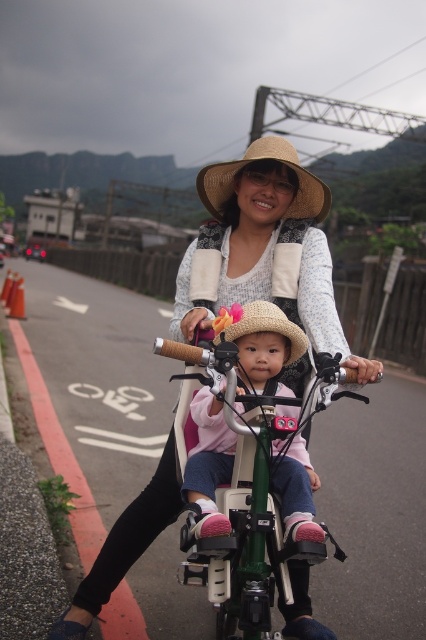
From the picture: Can you confirm if matte straw hat at center is thinner than strawmaterial/texturehat at upper center?

Yes, matte straw hat at center is thinner than strawmaterial/texturehat at upper center.

Does matte straw hat at center appear on the left side of strawmaterial/texturehat at upper center?

Incorrect, matte straw hat at center is not on the left side of strawmaterial/texturehat at upper center.

The image size is (426, 640). What do you see at coordinates (267, 244) in the screenshot?
I see `matte straw hat at center` at bounding box center [267, 244].

The height and width of the screenshot is (640, 426). I want to click on matte straw hat at center, so click(267, 244).

Is matte straw hat at center to the right of green matte bicycle at center from the viewer's perspective?

Correct, you'll find matte straw hat at center to the right of green matte bicycle at center.

Is matte straw hat at center wider than green matte bicycle at center?

Incorrect, matte straw hat at center's width does not surpass green matte bicycle at center's.

Between point (170, 484) and point (218, 397), which one is positioned behind?

Point (170, 484)

Locate an element on the screen. The image size is (426, 640). matte straw hat at center is located at coordinates (267, 244).

Does matte straw hat at center appear on the right side of pink fleece jacket at center?

Correct, you'll find matte straw hat at center to the right of pink fleece jacket at center.

Is matte straw hat at center shorter than pink fleece jacket at center?

Indeed, matte straw hat at center has a lesser height compared to pink fleece jacket at center.

The height and width of the screenshot is (640, 426). What do you see at coordinates (267, 244) in the screenshot? I see `matte straw hat at center` at bounding box center [267, 244].

I want to click on matte straw hat at center, so click(267, 244).